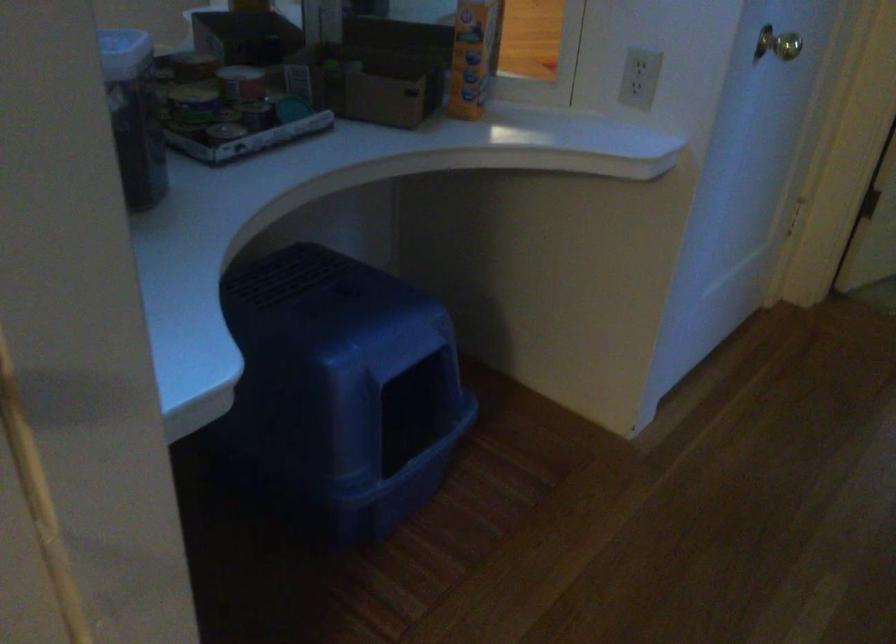
Identify the location of small cardboard box. Image resolution: width=896 pixels, height=644 pixels. (369, 82).